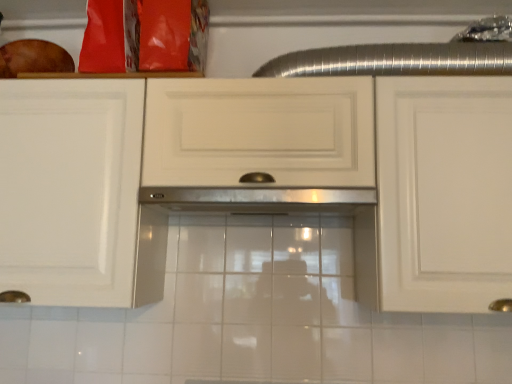
Measure the distance between point [165,197] and camera.

The distance of point [165,197] from camera is 3.75 feet.

This screenshot has height=384, width=512. In order to click on stainless steel exhaust hood at center in this screenshot , I will do `click(259, 199)`.

What do you see at coordinates (259, 199) in the screenshot? I see `stainless steel exhaust hood at center` at bounding box center [259, 199].

What do you see at coordinates (232, 176) in the screenshot?
I see `white glossy cabinet at center` at bounding box center [232, 176].

At what (x,y) coordinates should I click in order to perform the action: click on white glossy cabinet at center. Please return your answer as a coordinate pair (x, y). The height and width of the screenshot is (384, 512). Looking at the image, I should click on (232, 176).

Find the location of a particular element. This screenshot has width=512, height=384. stainless steel exhaust hood at center is located at coordinates (259, 199).

Can you confirm if white glossy cabinet at center is positioned to the right of stainless steel exhaust hood at center?

No.

Is white glossy cabinet at center closer to the viewer compared to stainless steel exhaust hood at center?

Yes, it is.

Which is nearer, [157,243] or [238,188]?

Clearly, point [157,243] is more distant from the camera than point [238,188].

From the image's perspective, which one is positioned lower, white glossy cabinet at center or stainless steel exhaust hood at center?

stainless steel exhaust hood at center appears lower in the image.

From a real-world perspective, between white glossy cabinet at center and stainless steel exhaust hood at center, who is vertically higher?

white glossy cabinet at center.

Considering the sizes of objects white glossy cabinet at center and stainless steel exhaust hood at center in the image provided, who is thinner, white glossy cabinet at center or stainless steel exhaust hood at center?

white glossy cabinet at center.

Considering the relative sizes of white glossy cabinet at center and stainless steel exhaust hood at center in the image provided, is white glossy cabinet at center shorter than stainless steel exhaust hood at center?

Incorrect, the height of white glossy cabinet at center does not fall short of that of stainless steel exhaust hood at center.

From the picture: Based on their sizes in the image, would you say white glossy cabinet at center is bigger or smaller than stainless steel exhaust hood at center?

white glossy cabinet at center is bigger than stainless steel exhaust hood at center.

Is white glossy cabinet at center completely or partially outside of stainless steel exhaust hood at center?

Yes.

Is white glossy cabinet at center touching stainless steel exhaust hood at center?

No, white glossy cabinet at center is not in contact with stainless steel exhaust hood at center.

Is white glossy cabinet at center facing away from stainless steel exhaust hood at center?

Correct, white glossy cabinet at center is looking away from stainless steel exhaust hood at center.

How different are the orientations of white glossy cabinet at center and stainless steel exhaust hood at center in degrees?

They differ by 0.691 degrees in their facing directions.

Identify the location of cabinetry in front of the stainless steel exhaust hood at center. (232, 176).

Considering the relative positions of stainless steel exhaust hood at center and white glossy cabinet at center in the image provided, is stainless steel exhaust hood at center to the right of white glossy cabinet at center from the viewer's perspective?

Yes.

Is stainless steel exhaust hood at center further to camera compared to white glossy cabinet at center?

Yes, it is.

Does point (316, 191) come farther from viewer compared to point (458, 263)?

Yes, point (316, 191) is farther from viewer.

From the image's perspective, is stainless steel exhaust hood at center on top of white glossy cabinet at center?

Incorrect, from the image's perspective, stainless steel exhaust hood at center is lower than white glossy cabinet at center.

From a real-world perspective, is stainless steel exhaust hood at center located beneath white glossy cabinet at center?

Yes.

In terms of width, does stainless steel exhaust hood at center look wider or thinner when compared to white glossy cabinet at center?

Considering their sizes, stainless steel exhaust hood at center looks broader than white glossy cabinet at center.

Is stainless steel exhaust hood at center taller or shorter than white glossy cabinet at center?

In the image, stainless steel exhaust hood at center appears to be shorter than white glossy cabinet at center.

Looking at the image, does stainless steel exhaust hood at center seem bigger or smaller compared to white glossy cabinet at center?

In the image, stainless steel exhaust hood at center appears to be smaller than white glossy cabinet at center.

Could white glossy cabinet at center be considered to be inside stainless steel exhaust hood at center?

No, white glossy cabinet at center is not surrounded by stainless steel exhaust hood at center.

In the scene shown: Are stainless steel exhaust hood at center and white glossy cabinet at center located far from each other?

No, stainless steel exhaust hood at center is not far from white glossy cabinet at center.

Is stainless steel exhaust hood at center aimed at white glossy cabinet at center?

Yes, stainless steel exhaust hood at center faces towards white glossy cabinet at center.

Where is `exhaust hood behind the white glossy cabinet at center`? The width and height of the screenshot is (512, 384). exhaust hood behind the white glossy cabinet at center is located at coordinates (259, 199).

Locate an element on the screen. This screenshot has width=512, height=384. cabinetry located above the stainless steel exhaust hood at center (from a real-world perspective) is located at coordinates (232, 176).

I want to click on exhaust hood on the right of white glossy cabinet at center, so click(x=259, y=199).